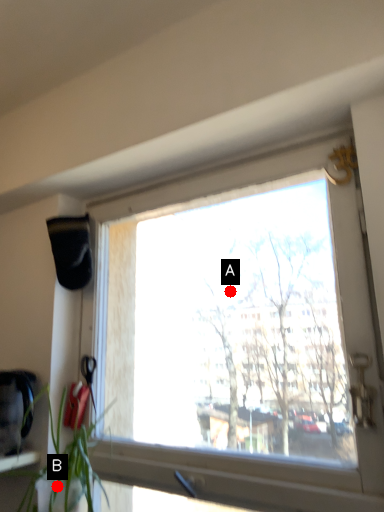
Question: Two points are circled on the image, labeled by A and B beside each circle. Which point appears closest to the camera in this image?

Choices:
 (A) A is closer
 (B) B is closer

Answer: (B)